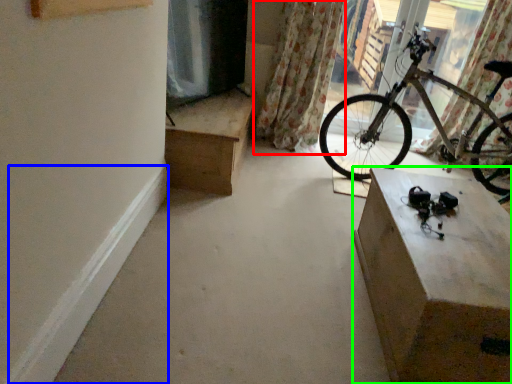
Question: Which object is the farthest from curtain (highlighted by a red box)? Choose among these: curb (highlighted by a blue box) or cabinetry (highlighted by a green box).

Choices:
 (A) curb
 (B) cabinetry

Answer: (A)